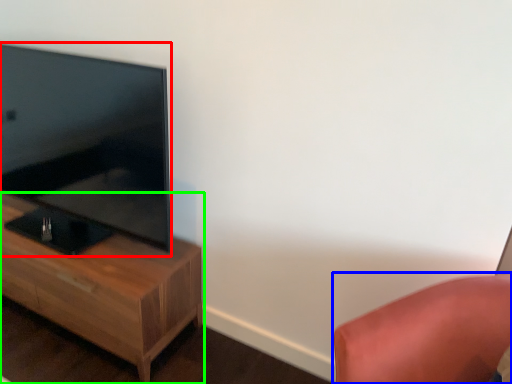
Question: Based on their relative distances, which object is farther from television (highlighted by a red box)? Choose from furniture (highlighted by a blue box) and nightstand (highlighted by a green box).

Choices:
 (A) furniture
 (B) nightstand

Answer: (A)